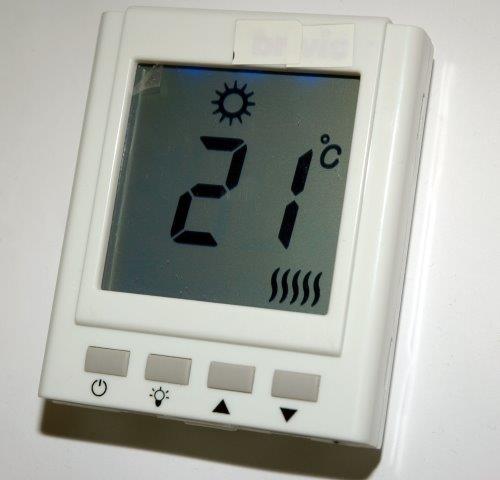
Where is `stickers`? This screenshot has width=500, height=480. stickers is located at coordinates [x=294, y=53].